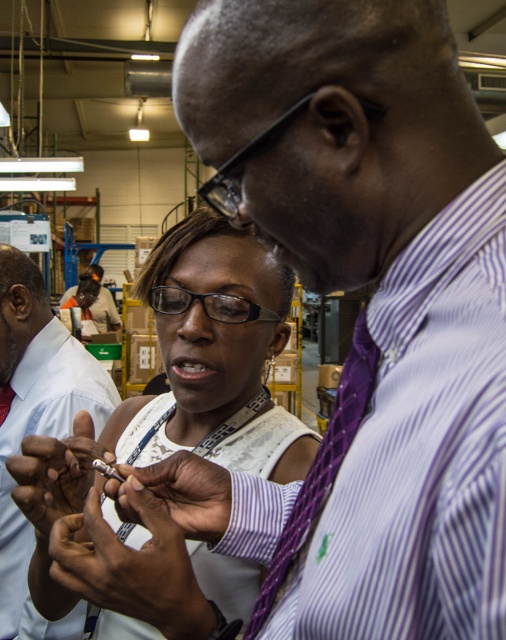
You are a worker in the factory and need to retrieve an item from your desk. The desk has the purple woven tie at center and the matte silver pen at center. If you reach for the pen first, will you have to move the tie to access it?

The purple woven tie at center is 9.27 inches away from the matte silver pen at center, so you do not need to move the tie to access the pen since they are not directly overlapping.

You are a quality inspector in this factory. You need to determine if the purple striped shirt at center can be used to cover the matte silver pen at center during a safety inspection. Based on their sizes, is this feasible?

The purple striped shirt at center is bigger than the matte silver pen at center, so yes, it can be used to cover the matte silver pen at center during the inspection.

You are a maintenance technician in the factory. You need to reach the purple striped shirt at center to hand over a tool. However, you are currently holding the matte silver pen at center. Can you safely hand over the tool without moving closer than 24 inches? Explain your reasoning.

The distance between the purple striped shirt at center and the matte silver pen at center is 26.98 inches. Since 26.98 inches is greater than 24 inches, you can safely hand over the tool without needing to move closer than the required distance.